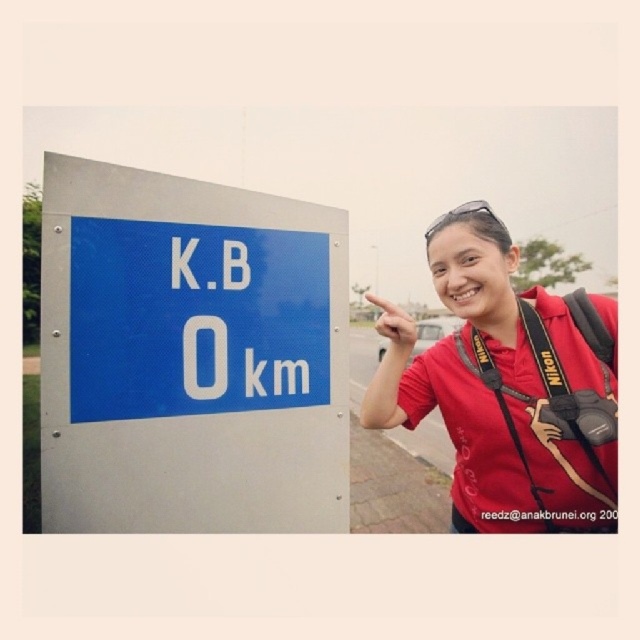
Question: Can you confirm if blue glossy sign at left is positioned below matte red shirt at center?

Choices:
 (A) yes
 (B) no

Answer: (B)

Question: Based on their relative distances, which object is nearer to the blue glossy sign at left?

Choices:
 (A) matte red shirt at center
 (B) clear plastic goggles at upper center

Answer: (A)

Question: Which of the following is the closest to the observer?

Choices:
 (A) clear plastic goggles at upper center
 (B) blue glossy sign at left

Answer: (B)

Question: Is matte red shirt at center above clear plastic goggles at upper center?

Choices:
 (A) yes
 (B) no

Answer: (B)

Question: Is blue glossy sign at left below matte red shirt at center?

Choices:
 (A) no
 (B) yes

Answer: (A)

Question: Among these points, which one is nearest to the camera?

Choices:
 (A) (394, 369)
 (B) (486, 211)
 (C) (240, 458)

Answer: (C)